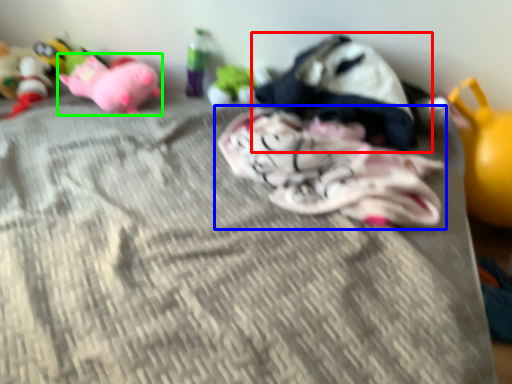
Question: Estimate the real-world distances between objects in this image. Which object is farther from toy (highlighted by a red box), toy (highlighted by a blue box) or toy (highlighted by a green box)?

Choices:
 (A) toy
 (B) toy

Answer: (B)